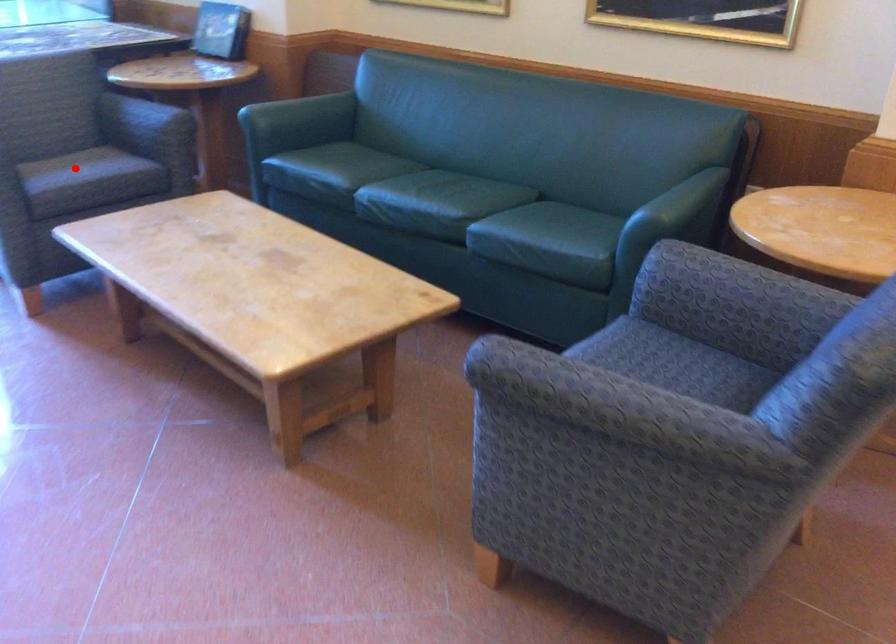
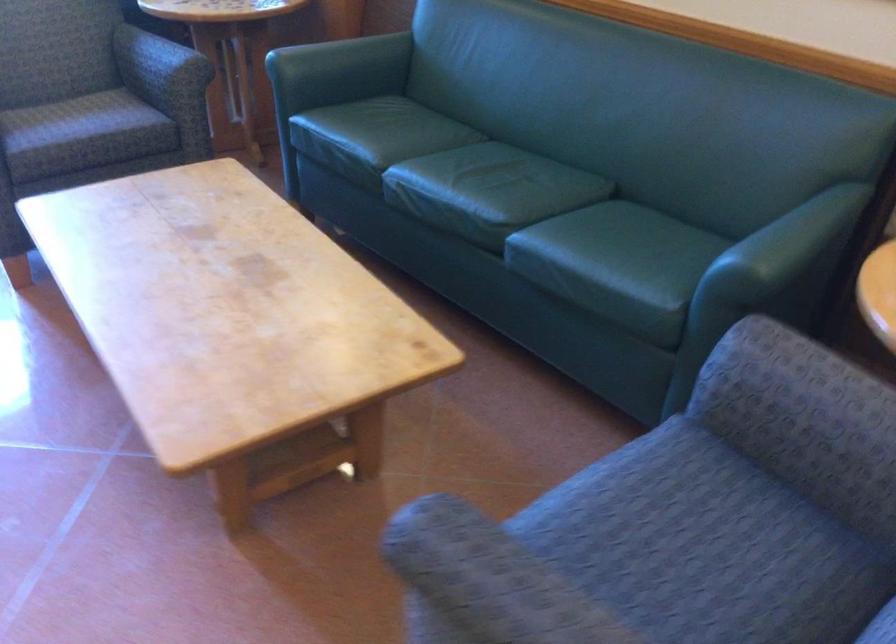
Question: I am providing you with two images of the same scene from different viewpoints. In image1, a red point is highlighted. Considering the same 3D point in image2, which of the following is correct?

Choices:
 (A) It is closer
 (B) It is farther

Answer: (A)